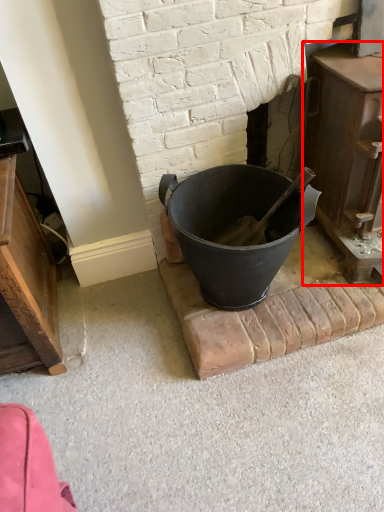
Question: From the image's perspective, what is the correct spatial positioning of fireplace (annotated by the red box) in reference to bucket?

Choices:
 (A) below
 (B) above

Answer: (B)